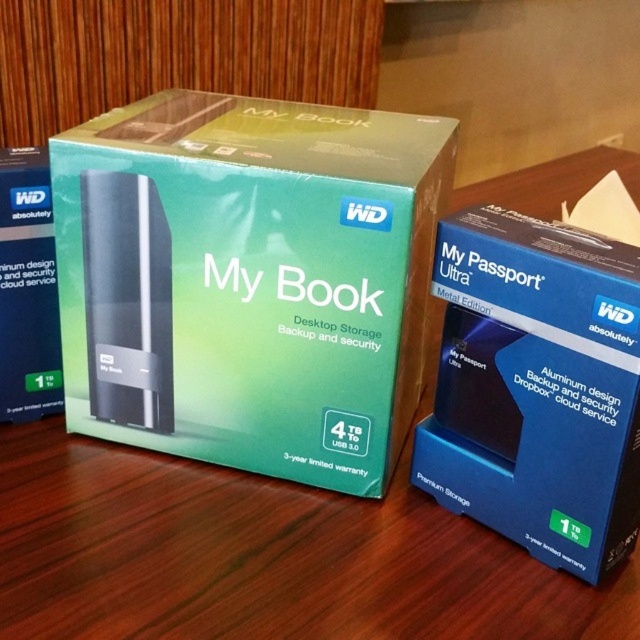
Question: Among these points, which one is farthest from the camera?

Choices:
 (A) (148, 284)
 (B) (33, 179)

Answer: (B)

Question: Does blue aluminum my passport ultra at right appear under matte black hard drive at left?

Choices:
 (A) yes
 (B) no

Answer: (A)

Question: Which of these objects is positioned farthest from the green matte box at center?

Choices:
 (A) matte black hard drive at left
 (B) blue aluminum my passport ultra at right

Answer: (A)

Question: Is green matte box at center smaller than matte black hard drive at left?

Choices:
 (A) yes
 (B) no

Answer: (B)

Question: Does blue aluminum my passport ultra at right have a smaller size compared to matte black hard drive at left?

Choices:
 (A) yes
 (B) no

Answer: (B)

Question: Which of the following is the closest to the observer?

Choices:
 (A) green matte box at center
 (B) matte black hard drive at left

Answer: (A)